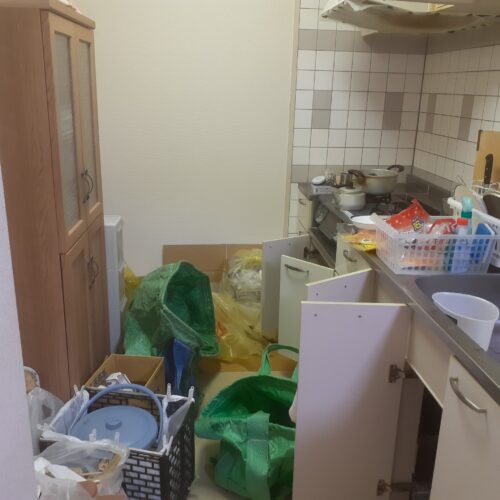
Identify the location of door. This screenshot has width=500, height=500. (448, 463), (325, 413), (341, 300), (301, 286), (71, 170), (100, 143), (79, 338), (108, 295).